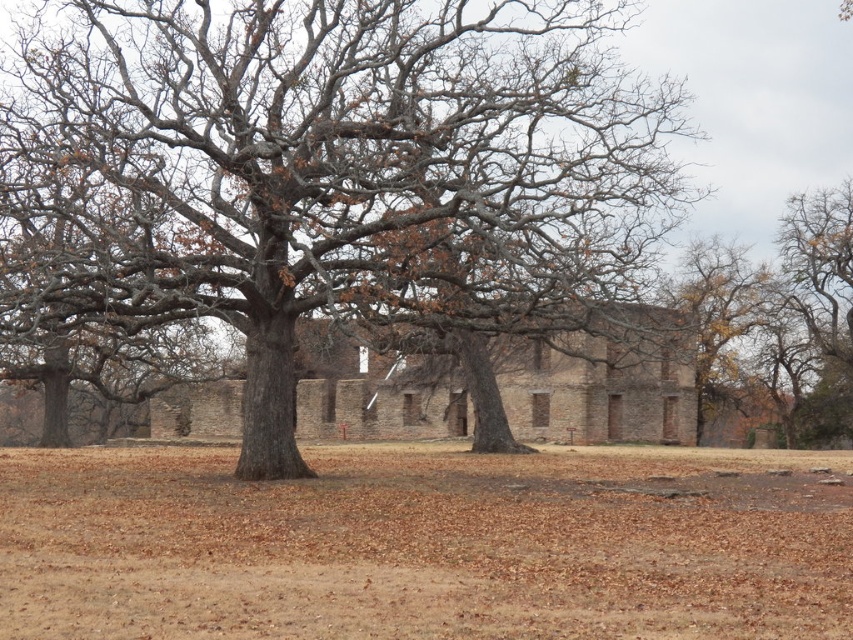
Who is more forward, (561,502) or (706,333)?

Positioned in front is point (561,502).

You are a GUI agent. You are given a task and a screenshot of the screen. Output one action in this format:
    pyautogui.click(x=<x>, y=<y>)
    Task: Click on the brown dry grass at center
    Image resolution: width=853 pixels, height=640 pixels.
    Given the screenshot: What is the action you would take?
    pyautogui.click(x=425, y=544)

Does brown rough bark tree at center have a greater width compared to brown dry grass at center?

No, brown rough bark tree at center is not wider than brown dry grass at center.

Between brown rough bark tree at center and brown dry grass at center, which one is positioned higher?

brown rough bark tree at center is above.

The width and height of the screenshot is (853, 640). I want to click on brown rough bark tree at center, so click(334, 177).

Which is in front, point (509, 116) or point (670, 285)?

Positioned in front is point (509, 116).

The width and height of the screenshot is (853, 640). In order to click on brown rough bark tree at center in this screenshot , I will do `click(334, 177)`.